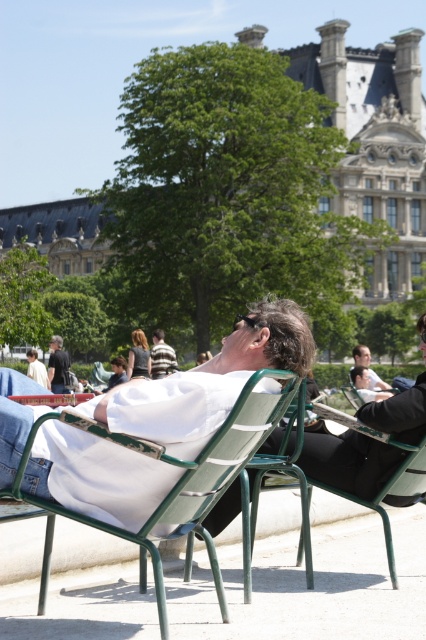
Does green metal beach chair at center appear over matte black jacket at center?

No, green metal beach chair at center is not above matte black jacket at center.

Does green metal beach chair at center have a larger size compared to matte black jacket at center?

Indeed, green metal beach chair at center has a larger size compared to matte black jacket at center.

This screenshot has height=640, width=426. What are the coordinates of `green metal beach chair at center` in the screenshot? It's located at (325, 486).

Who is lower down, green metal beach chair at center or dark gray shirt at center?

green metal beach chair at center

Is green metal beach chair at center below dark gray shirt at center?

Correct, green metal beach chair at center is located below dark gray shirt at center.

At what (x,y) coordinates should I click in order to perform the action: click on green metal beach chair at center. Please return your answer as a coordinate pair (x, y). This screenshot has width=426, height=640. Looking at the image, I should click on (325, 486).

This screenshot has width=426, height=640. Find the location of `green metal beach chair at center`. green metal beach chair at center is located at coordinates (325, 486).

Measure the distance between point (54, 368) and camera.

105.14 meters

Does dark gray shirt at center have a lesser height compared to white cotton shirt at center?

Incorrect, dark gray shirt at center's height does not fall short of white cotton shirt at center's.

Locate an element on the screen. The image size is (426, 640). dark gray shirt at center is located at coordinates (57, 365).